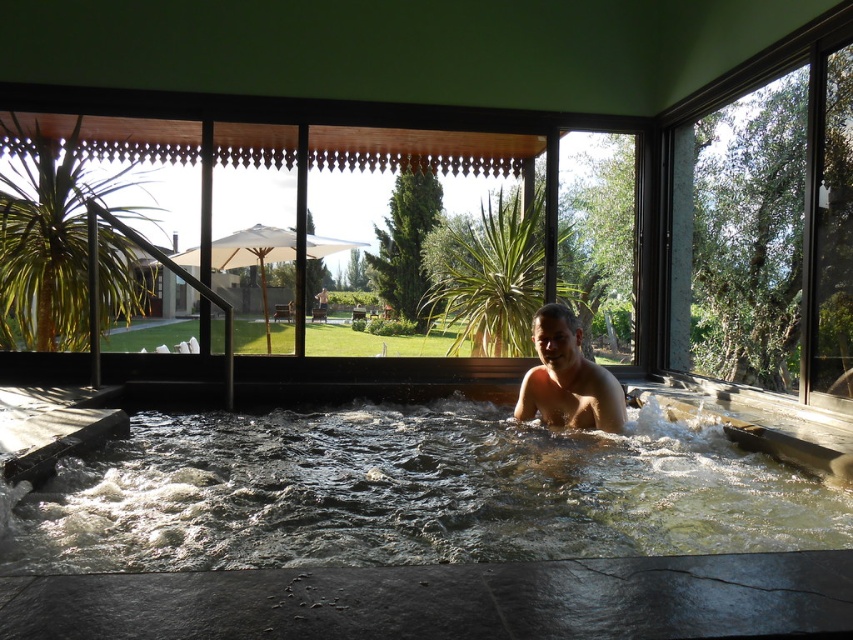
Is clear water at center taller than smooth tan skin at center?

No.

Can you confirm if clear water at center is wider than smooth tan skin at center?

Indeed, clear water at center has a greater width compared to smooth tan skin at center.

Between point (213, 516) and point (558, 352), which one is positioned behind?

Point (558, 352)

Identify the location of clear water at center. (407, 493).